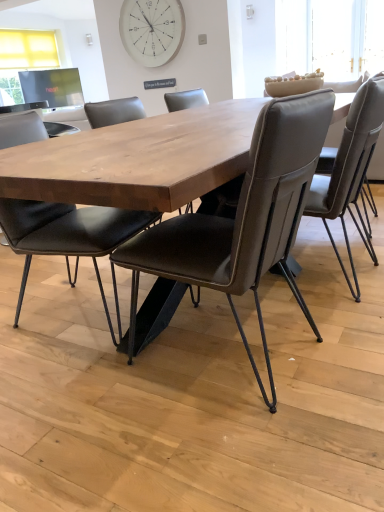
Question: From a real-world perspective, is white wooden clock at upper center physically above leather-like chair at center, the third chair positioned from the left?

Choices:
 (A) yes
 (B) no

Answer: (A)

Question: Does white wooden clock at upper center have a smaller size compared to leather-like chair at center, the third chair positioned from the left?

Choices:
 (A) no
 (B) yes

Answer: (B)

Question: Is white wooden clock at upper center turned away from leather-like chair at center, marked as the 1th chair in a right-to-left arrangement?

Choices:
 (A) yes
 (B) no

Answer: (B)

Question: Is the depth of white wooden clock at upper center less than that of leather-like chair at center, marked as the 1th chair in a right-to-left arrangement?

Choices:
 (A) yes
 (B) no

Answer: (B)

Question: Does white wooden clock at upper center have a greater width compared to leather-like chair at center, the third chair positioned from the left?

Choices:
 (A) yes
 (B) no

Answer: (B)

Question: Can you confirm if white wooden clock at upper center is taller than leather-like chair at center, marked as the 1th chair in a right-to-left arrangement?

Choices:
 (A) no
 (B) yes

Answer: (A)

Question: Is brown leather chair at center, which is the second chair from right to left, wider than matte black chair at center, positioned as the 1th chair in left-to-right order?

Choices:
 (A) yes
 (B) no

Answer: (A)

Question: Are brown leather chair at center, the 2th chair viewed from the left, and matte black chair at center, positioned as the 1th chair in left-to-right order, beside each other?

Choices:
 (A) yes
 (B) no

Answer: (B)

Question: Is brown leather chair at center, which is the second chair from right to left, positioned beyond the bounds of matte black chair at center, positioned as the 1th chair in left-to-right order?

Choices:
 (A) no
 (B) yes

Answer: (B)

Question: Can you confirm if brown leather chair at center, the 2th chair viewed from the left, is thinner than matte black chair at center, which ranks as the 3th chair in right-to-left order?

Choices:
 (A) yes
 (B) no

Answer: (B)

Question: Is matte black chair at center, which ranks as the 3th chair in right-to-left order, a part of brown leather chair at center, which is the second chair from right to left?

Choices:
 (A) yes
 (B) no

Answer: (B)

Question: Is brown leather chair at center, the 2th chair viewed from the left, positioned behind matte black chair at center, which ranks as the 3th chair in right-to-left order?

Choices:
 (A) yes
 (B) no

Answer: (B)

Question: Would you say brown leather chair at center, the 2th chair viewed from the left, is part of matte black chair at center, which ranks as the 3th chair in right-to-left order,'s contents?

Choices:
 (A) no
 (B) yes

Answer: (A)